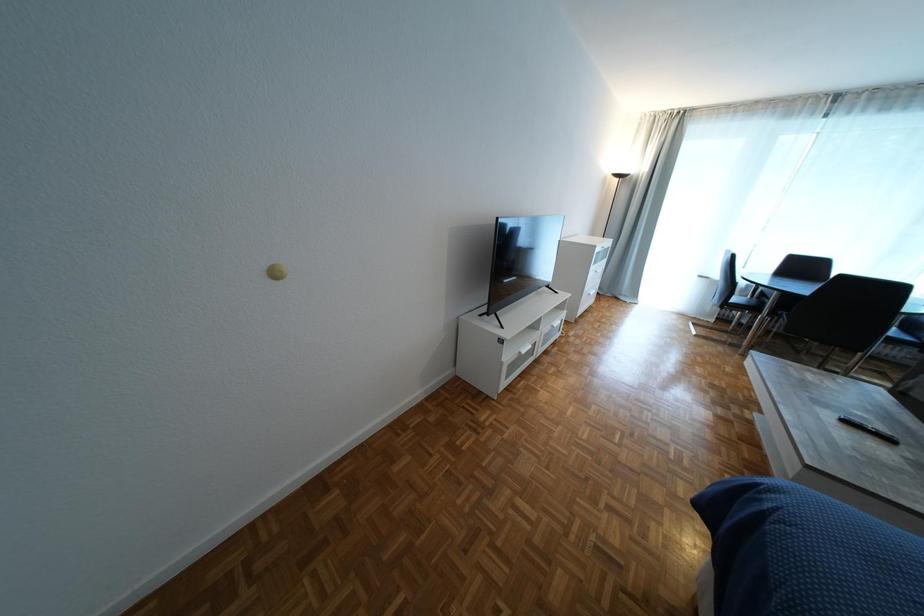
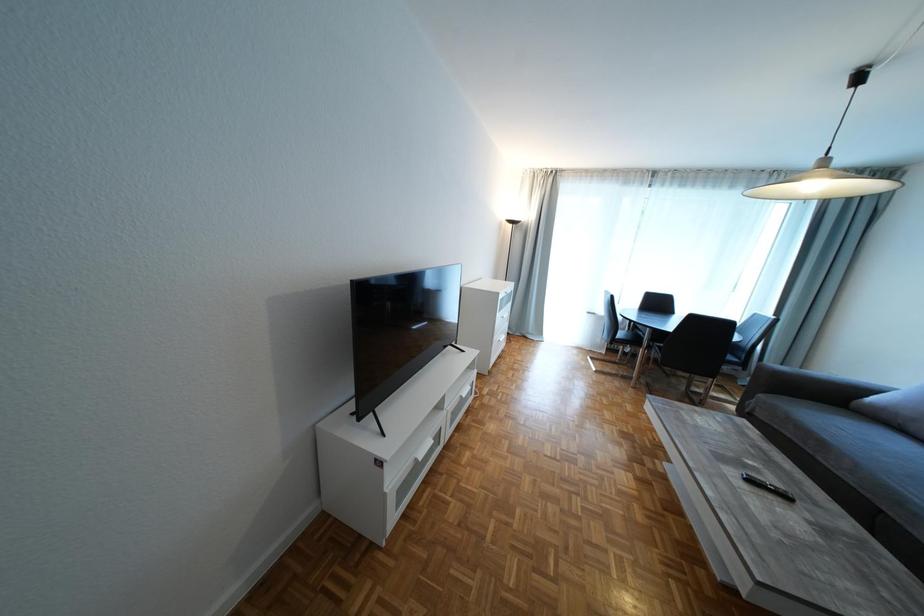
Question: The camera is either moving clockwise (left) or counter-clockwise (right) around the object. The first image is from the beginning of the video and the second image is from the end. Is the camera moving left or right when shooting the video?

Choices:
 (A) Left
 (B) Right

Answer: (A)